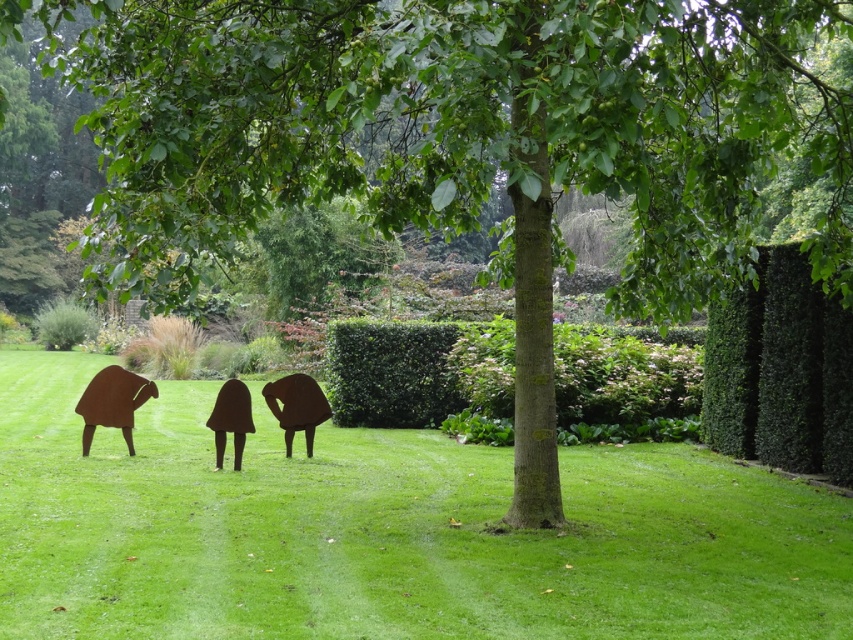
Question: Which is farther from the rusty metal figures at center?

Choices:
 (A) rusty metal sculpture at lower left
 (B) green leafy hedge at right
 (C) rusty metal sculpture at center

Answer: (B)

Question: Which point is closer to the camera taking this photo?

Choices:
 (A) (117, 378)
 (B) (318, 396)
 (C) (224, 387)
 (D) (64, 550)

Answer: (D)

Question: Does green leafy hedge at right appear over rusty metal sculpture at center?

Choices:
 (A) no
 (B) yes

Answer: (B)

Question: Does rusty metal figure at center appear on the right side of rusty metal sculpture at center?

Choices:
 (A) yes
 (B) no

Answer: (A)

Question: Which is nearer to the green leafy hedge at center?

Choices:
 (A) rusty metal sculpture at center
 (B) rusty metal figure at center

Answer: (B)

Question: Does green leafy hedge at center have a lesser width compared to rusty metal figures at center?

Choices:
 (A) no
 (B) yes

Answer: (A)